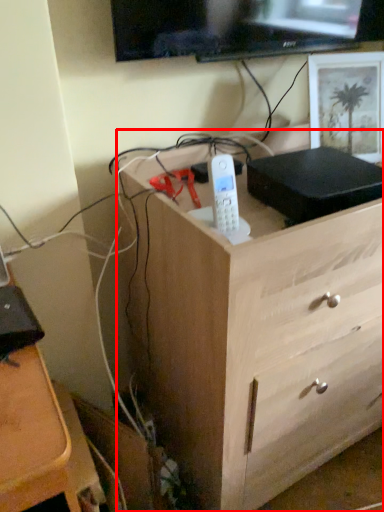
Question: From the image's perspective, where is chest of drawers (annotated by the red box) located in relation to picture frame in the image?

Choices:
 (A) above
 (B) below

Answer: (B)